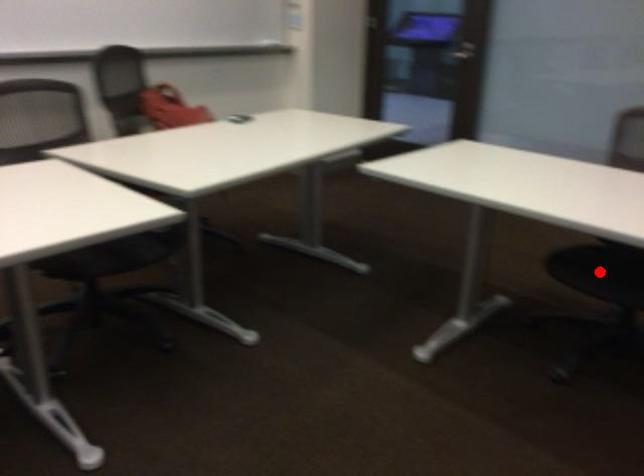
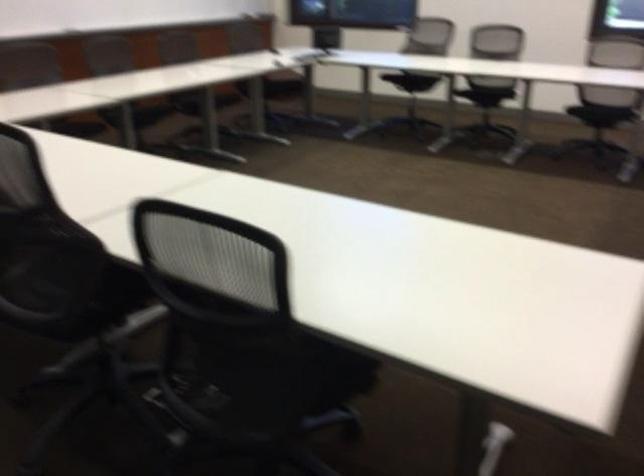
Question: I am providing you with two images of the same scene from different viewpoints. A red point is marked on the first image. Is the red point's position out of view in image 2?

Choices:
 (A) Yes
 (B) No

Answer: (A)